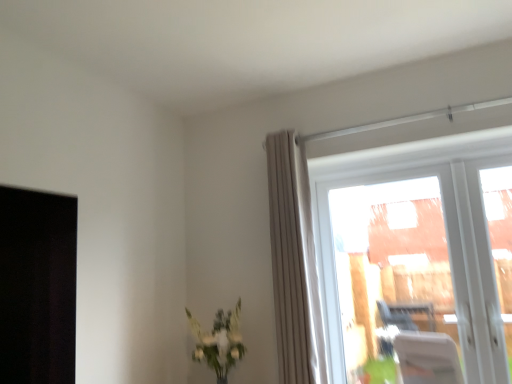
Question: Is point (330, 355) positioned closer to the camera than point (208, 352)?

Choices:
 (A) closer
 (B) farther

Answer: (B)

Question: In terms of width, does transparent glass window at upper right look wider or thinner when compared to green leafy plant at lower center?

Choices:
 (A) thin
 (B) wide

Answer: (A)

Question: Estimate the real-world distances between objects in this image. Which object is farther from the beige textured curtain at upper right?

Choices:
 (A) transparent glass window at upper right
 (B) green leafy plant at lower center

Answer: (A)

Question: Which object is positioned farthest from the green leafy plant at lower center?

Choices:
 (A) beige textured curtain at upper right
 (B) transparent glass window at upper right

Answer: (B)